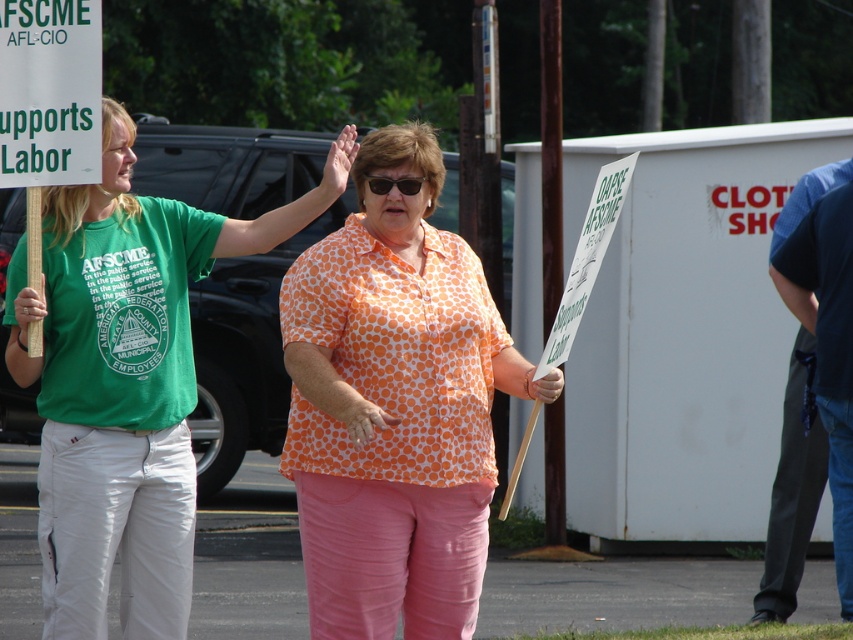
You are a photographer trying to capture a clear shot of the orange dotted shirt at center and the black plastic sunglasses at center. Which object is closer to the camera?

The orange dotted shirt at center is in front of the black plastic sunglasses at center, so the orange dotted shirt at center is closer to the camera.

You are a photographer trying to capture a clear shot of both the green fabric shirt at left and the black plastic sunglasses at center. Since you want to ensure both are visible, which object should you focus on first to account for their size?

The green fabric shirt at left is bigger than the black plastic sunglasses at center, so you should focus on the green fabric shirt at left first to ensure it is in clear view before adjusting for the smaller sunglasses.